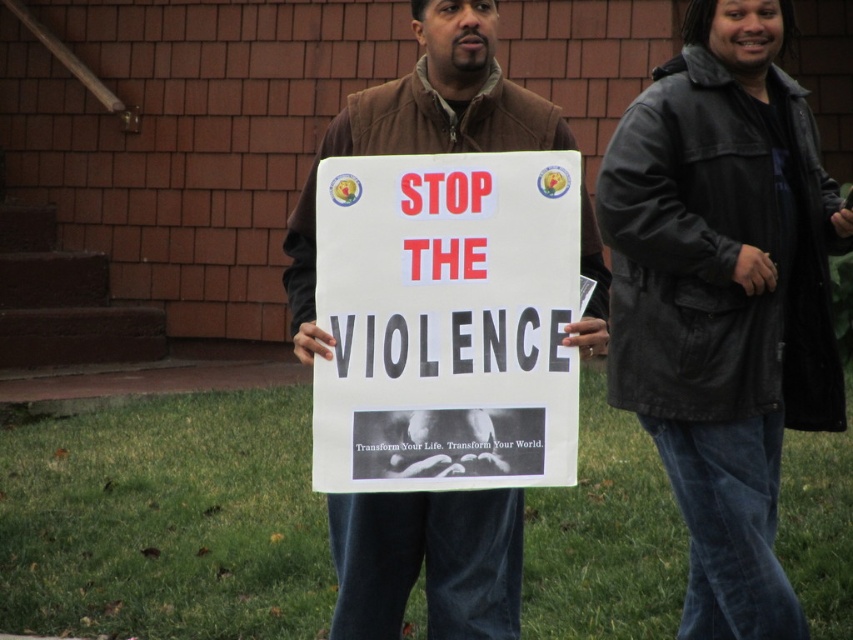
Question: Which point appears farthest from the camera in this image?

Choices:
 (A) (498, 522)
 (B) (766, 186)

Answer: (B)

Question: Which is nearer to the black leather jacket at center?

Choices:
 (A) brown leather jacket at center
 (B) white paper sign at center

Answer: (A)

Question: Does white paper sign at center appear on the left side of brown leather jacket at center?

Choices:
 (A) yes
 (B) no

Answer: (B)

Question: Can you confirm if white paper sign at center is bigger than brown leather jacket at center?

Choices:
 (A) no
 (B) yes

Answer: (A)

Question: Is black leather jacket at center thinner than white paper sign at center?

Choices:
 (A) no
 (B) yes

Answer: (A)

Question: Which object is closer to the camera taking this photo?

Choices:
 (A) brown leather jacket at center
 (B) black leather jacket at center

Answer: (A)